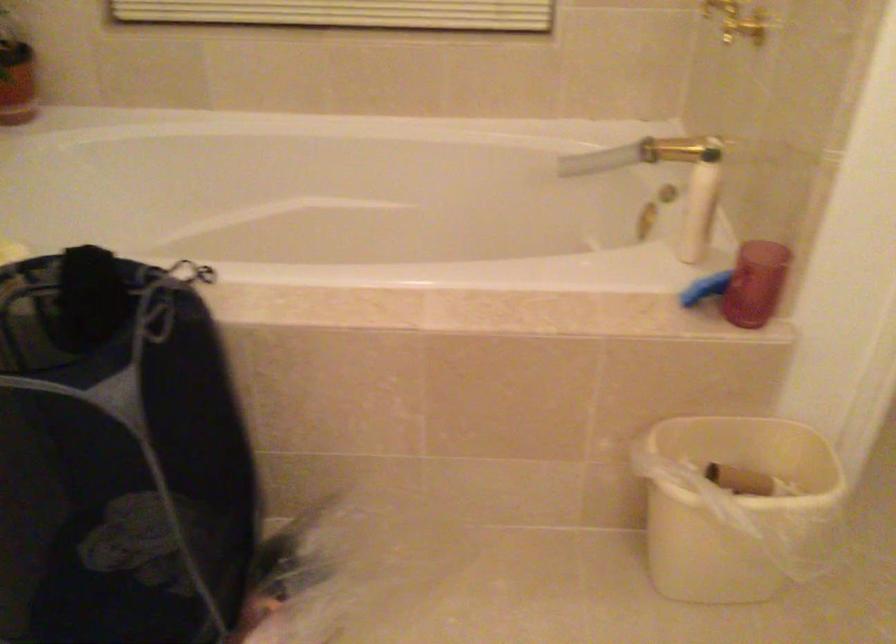
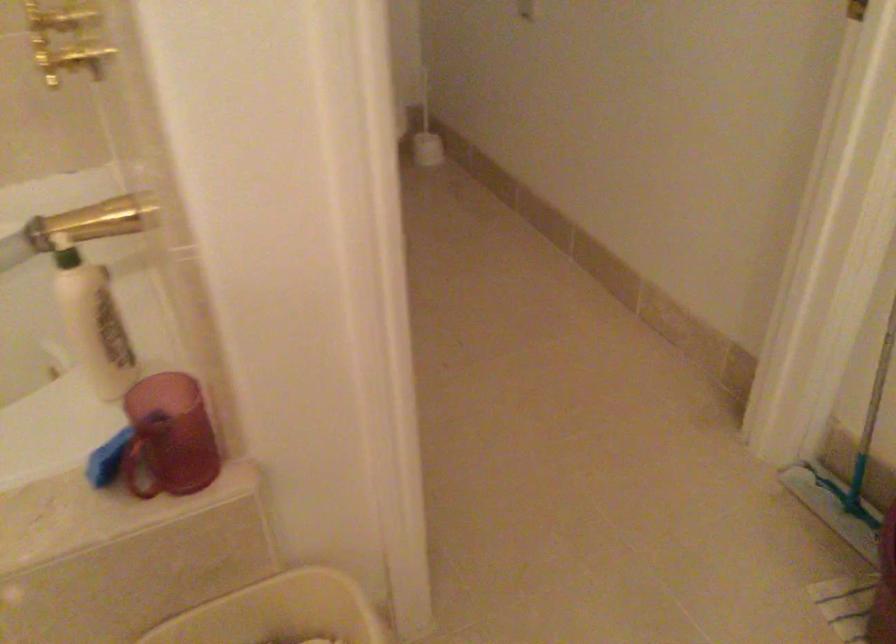
Find the pixel in the second image that matches point (703, 304) in the first image.

(140, 462)